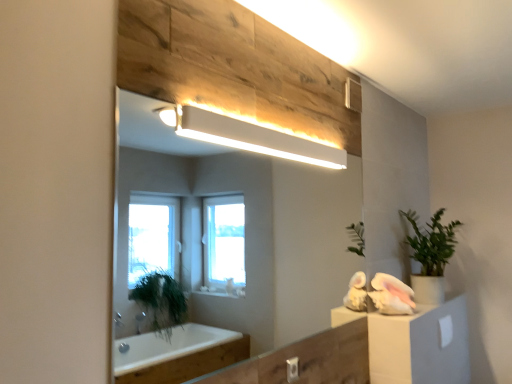
Question: Is white glossy mirror at upper center surrounded by white fluffy towel at right?

Choices:
 (A) yes
 (B) no

Answer: (B)

Question: From the image's perspective, is white fluffy towel at right on top of white glossy mirror at upper center?

Choices:
 (A) yes
 (B) no

Answer: (B)

Question: Is white fluffy towel at right taller than white glossy mirror at upper center?

Choices:
 (A) yes
 (B) no

Answer: (B)

Question: From a real-world perspective, is white fluffy towel at right on top of white glossy mirror at upper center?

Choices:
 (A) no
 (B) yes

Answer: (A)

Question: From the image's perspective, is white fluffy towel at right located beneath white glossy mirror at upper center?

Choices:
 (A) yes
 (B) no

Answer: (A)

Question: From a real-world perspective, is white glossy mirror at upper center positioned above or below green matte plant at right?

Choices:
 (A) below
 (B) above

Answer: (B)

Question: Considering the positions of white glossy mirror at upper center and green matte plant at right in the image, is white glossy mirror at upper center bigger or smaller than green matte plant at right?

Choices:
 (A) small
 (B) big

Answer: (A)

Question: Considering the positions of white glossy mirror at upper center and green matte plant at right in the image, is white glossy mirror at upper center wider or thinner than green matte plant at right?

Choices:
 (A) wide
 (B) thin

Answer: (B)

Question: Considering the positions of white glossy mirror at upper center and green matte plant at right in the image, is white glossy mirror at upper center taller or shorter than green matte plant at right?

Choices:
 (A) tall
 (B) short

Answer: (A)

Question: Is white matte rectangular light fixture at upper center wider or thinner than white fluffy towel at right?

Choices:
 (A) wide
 (B) thin

Answer: (B)

Question: From the image's perspective, is white matte rectangular light fixture at upper center positioned above or below white fluffy towel at right?

Choices:
 (A) below
 (B) above

Answer: (B)

Question: From their relative heights in the image, would you say white matte rectangular light fixture at upper center is taller or shorter than white fluffy towel at right?

Choices:
 (A) tall
 (B) short

Answer: (B)

Question: Based on their positions, is white matte rectangular light fixture at upper center located to the left or right of white fluffy towel at right?

Choices:
 (A) left
 (B) right

Answer: (A)

Question: From a real-world perspective, is green matte plant at right above or below white matte rectangular light fixture at upper center?

Choices:
 (A) below
 (B) above

Answer: (A)

Question: In terms of height, does green matte plant at right look taller or shorter compared to white matte rectangular light fixture at upper center?

Choices:
 (A) tall
 (B) short

Answer: (A)